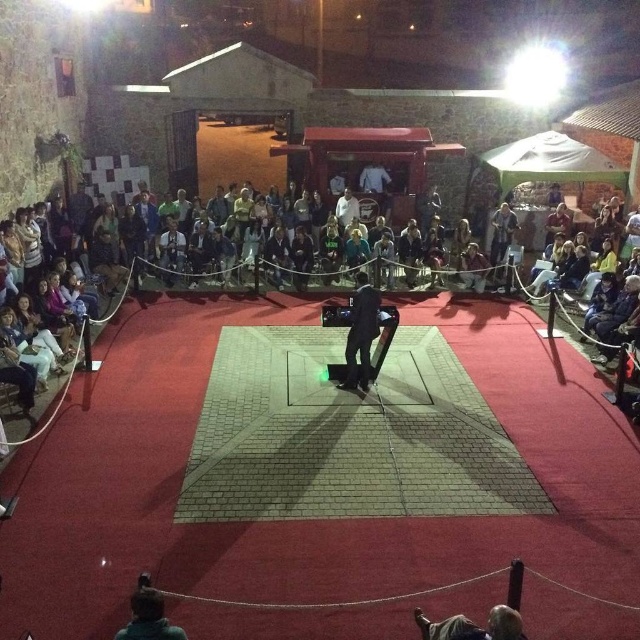
You are an event planner trying to set up a camera to capture the performer on the red carpeted stage at center. The camera must be placed at point (x=360, y=333). Where should you position the camera to ensure it captures the dark gray fabric pants at center?

The dark gray fabric pants at center is located at point (x=360, y=333), so positioning the camera at that exact point would center the performer in the frame.

You are an event organizer who needs to ensure that the light brown leather jacket at center and the white cotton shirt at center are visible to the audience. Given their sizes, which one might require additional lighting to stand out?

The light brown leather jacket at center is bigger than the white cotton shirt at center, so it might not require additional lighting since its larger size already makes it more visible to the audience.

You are a stagehand at the event and need to ensure that the light brown leather jacket at center and the white cotton shirt at center are visible to the audience. Given that the stage lights have a maximum effective range of 4 meters, will both items be adequately illuminated?

The distance between the light brown leather jacket at center and the white cotton shirt at center is 4.21 meters. Since the stage lights can only effectively illuminate up to 4 meters, the items are slightly beyond the effective range, so they may not be adequately illuminated.